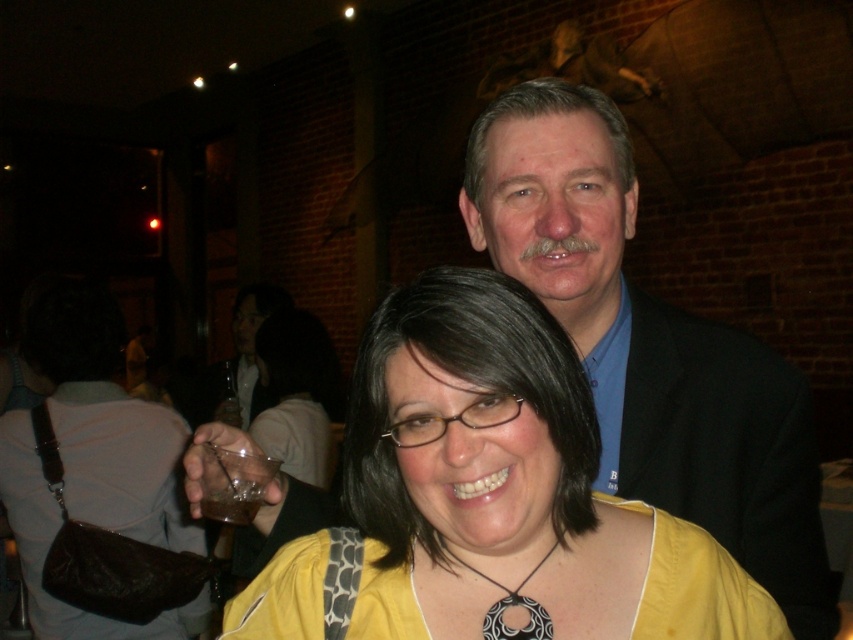
Question: Among these objects, which one is nearest to the camera?

Choices:
 (A) translucent glass at center
 (B) clear plastic cup at lower center
 (C) yellow matte shirt at center

Answer: (C)

Question: Is yellow matte shirt at center in front of translucent plastic cup at lower left?

Choices:
 (A) yes
 (B) no

Answer: (A)

Question: Which point is farther to the camera?

Choices:
 (A) clear plastic cup at lower center
 (B) translucent plastic cup at lower left

Answer: (B)

Question: Considering the relative positions of yellow matte shirt at center and black matte/porcelain pendant at center in the image provided, where is yellow matte shirt at center located with respect to black matte/porcelain pendant at center?

Choices:
 (A) right
 (B) left

Answer: (A)

Question: Considering the real-world distances, which object is closest to the yellow matte shirt at center?

Choices:
 (A) blue smooth shirt at upper center
 (B) black matte/porcelain pendant at center
 (C) clear plastic cup at lower center
 (D) translucent glass at center

Answer: (B)

Question: Does translucent glass at center appear over clear plastic cup at lower center?

Choices:
 (A) no
 (B) yes

Answer: (A)